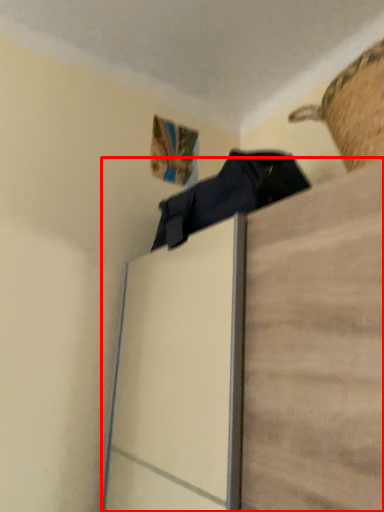
Question: From the image's perspective, where is furniture (annotated by the red box) located in relation to basket in the image?

Choices:
 (A) below
 (B) above

Answer: (A)